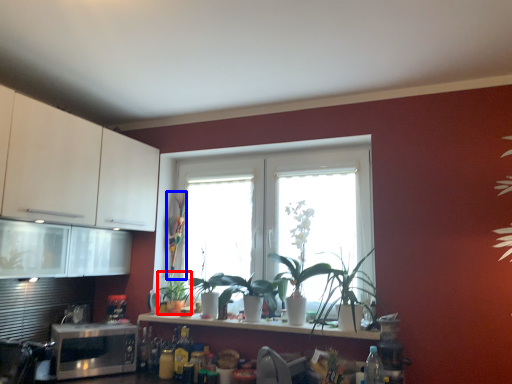
Question: Which object is further to the camera taking this photo, plant (highlighted by a red box) or plant (highlighted by a blue box)?

Choices:
 (A) plant
 (B) plant

Answer: (B)